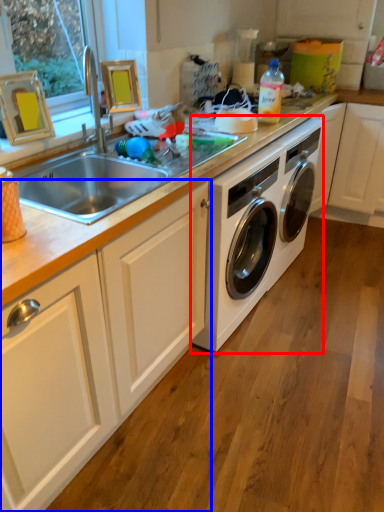
Question: Which object is further to the camera taking this photo, washing machine (highlighted by a red box) or cabinetry (highlighted by a blue box)?

Choices:
 (A) washing machine
 (B) cabinetry

Answer: (A)